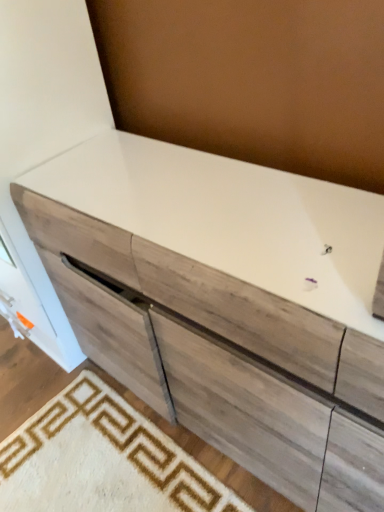
Where is `free space above wooden cabinet at center (from a real-world perspective)`? free space above wooden cabinet at center (from a real-world perspective) is located at coordinates (81, 426).